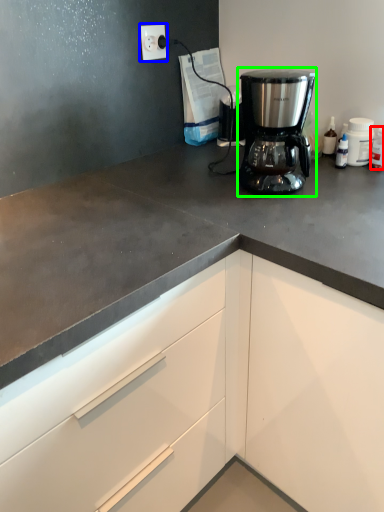
Question: Estimate the real-world distances between objects in this image. Which object is closer to bottle (highlighted by a red box), electric outlet (highlighted by a blue box) or coffee maker (highlighted by a green box)?

Choices:
 (A) electric outlet
 (B) coffee maker

Answer: (B)